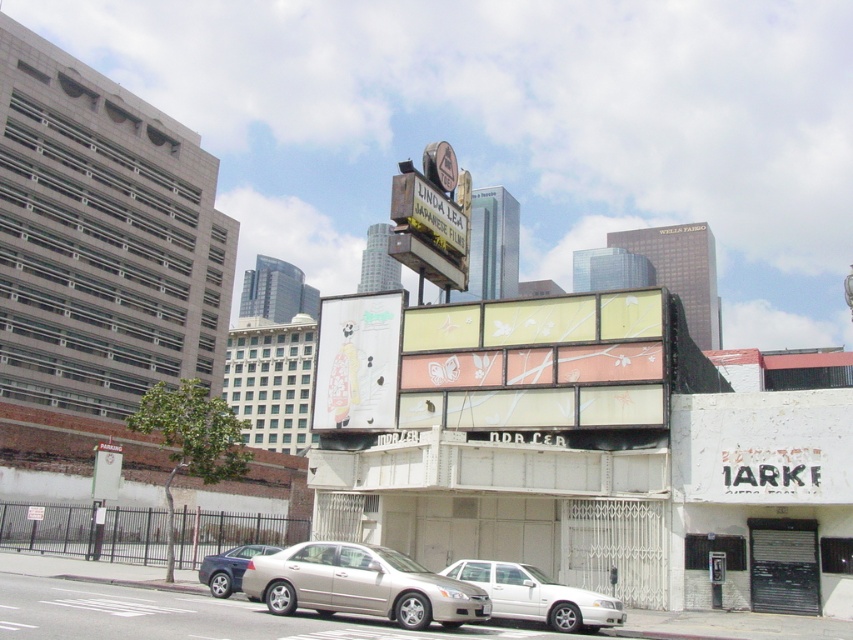
Can you confirm if silver metallic sedan at lower center is positioned to the right of silver metallic sedan at lower left?

Correct, you'll find silver metallic sedan at lower center to the right of silver metallic sedan at lower left.

Is point (537, 566) less distant than point (236, 561)?

No.

The width and height of the screenshot is (853, 640). What do you see at coordinates (537, 595) in the screenshot?
I see `silver metallic sedan at lower center` at bounding box center [537, 595].

Identify the location of silver metallic sedan at lower center. The width and height of the screenshot is (853, 640). (537, 595).

Between metallic silver sedan at center and silver metallic sedan at lower center, which one has less height?

silver metallic sedan at lower center

Which is in front, point (248, 573) or point (567, 586)?

Positioned in front is point (248, 573).

Locate an element on the screen. Image resolution: width=853 pixels, height=640 pixels. metallic silver sedan at center is located at coordinates (360, 584).

The height and width of the screenshot is (640, 853). Describe the element at coordinates (360, 584) in the screenshot. I see `metallic silver sedan at center` at that location.

Is metallic silver sedan at center wider than silver metallic sedan at lower left?

Yes.

Between point (393, 586) and point (248, 554), which one is positioned behind?

The point (248, 554) is more distant.

This screenshot has height=640, width=853. In order to click on metallic silver sedan at center in this screenshot , I will do `click(360, 584)`.